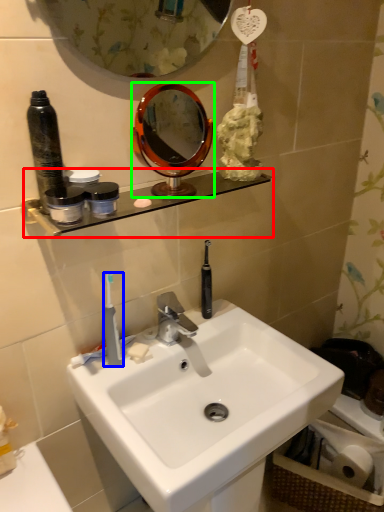
Question: Considering the real-world distances, which object is farthest from shelve (highlighted by a red box)? toothbrush (highlighted by a blue box) or mirror (highlighted by a green box)?

Choices:
 (A) toothbrush
 (B) mirror

Answer: (B)